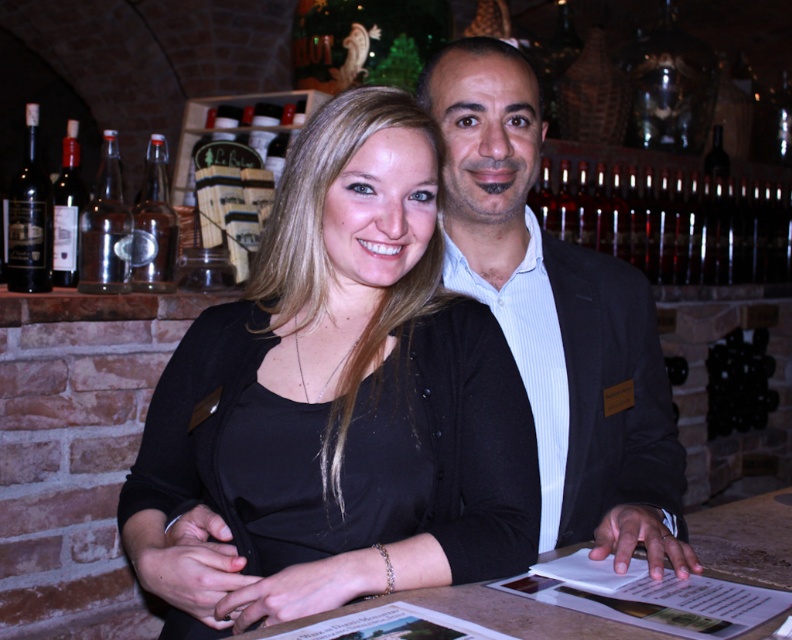
You are a customer at a wine tasting event and want to grab a bottle from the display. The shiny glass bottles at right and the black glass bottle at right are part of the display. If your hand can reach 18 inches, can you comfortably grab both bottles without moving your hand position?

The shiny glass bottles at right and black glass bottle at right are 19.53 inches apart from each other, so your hand cannot comfortably grab both bottles at the same time since the distance between them exceeds your reach of 18 inches.

You are standing in the bar and want to place a new name tag on the matte black suit at center. According to the coordinate system where the bottom left corner is the origin, what are the coordinates of the point where you should place the name tag?

The coordinates for the matte black suit at center are at point (558, 317). Therefore, you should place the name tag at those coordinates.

You are a customer at the bar and want to point out the shiny glass bottles at right and the black glass bottle at right to the server. Which one is located higher in the image?

The shiny glass bottles at right is above the black glass bottle at right, so the shiny glass bottles at right is higher in the image.